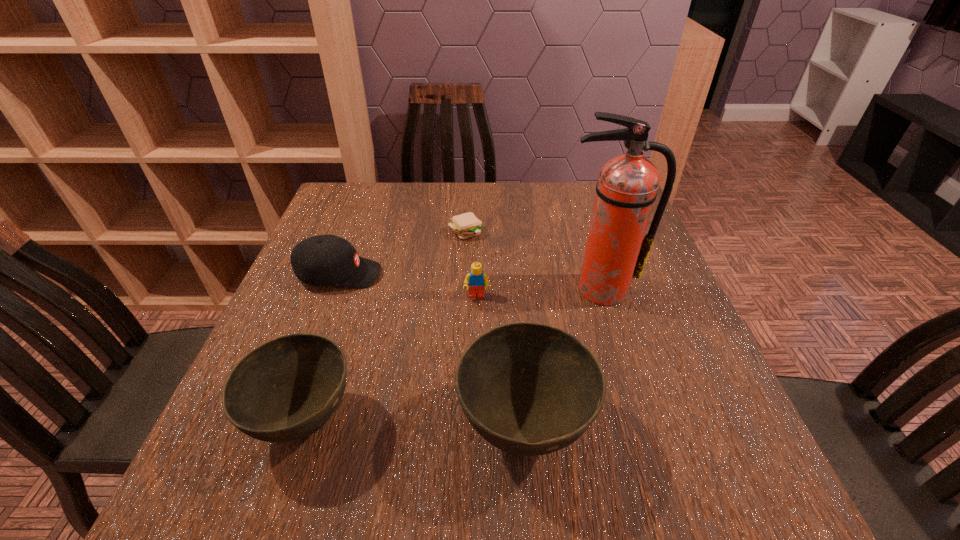
At what (x,y) coordinates should I click in order to perform the action: click on free space between the tallest object and the Lego. Please return your answer as a coordinate pair (x, y). Looking at the image, I should click on (539, 293).

Identify the location of object that stands as the fifth closest to the tallest object. This screenshot has width=960, height=540. (286, 389).

Select which object is the fourth closest to the shortest object. Please provide its 2D coordinates. Your answer should be formatted as a tuple, i.e. [(x, y)], where the tuple contains the x and y coordinates of a point satisfying the conditions above.

[(529, 389)]

Where is `vacant region that satisfies the following two spatial constraints: 1. with a logo on the front of the right bowl; 2. on the left side of the baseball cap`? vacant region that satisfies the following two spatial constraints: 1. with a logo on the front of the right bowl; 2. on the left side of the baseball cap is located at coordinates (282, 429).

Where is `vacant space that satisfies the following two spatial constraints: 1. on the back side of the right bowl; 2. with a logo on the front of the baseball cap`? vacant space that satisfies the following two spatial constraints: 1. on the back side of the right bowl; 2. with a logo on the front of the baseball cap is located at coordinates (512, 274).